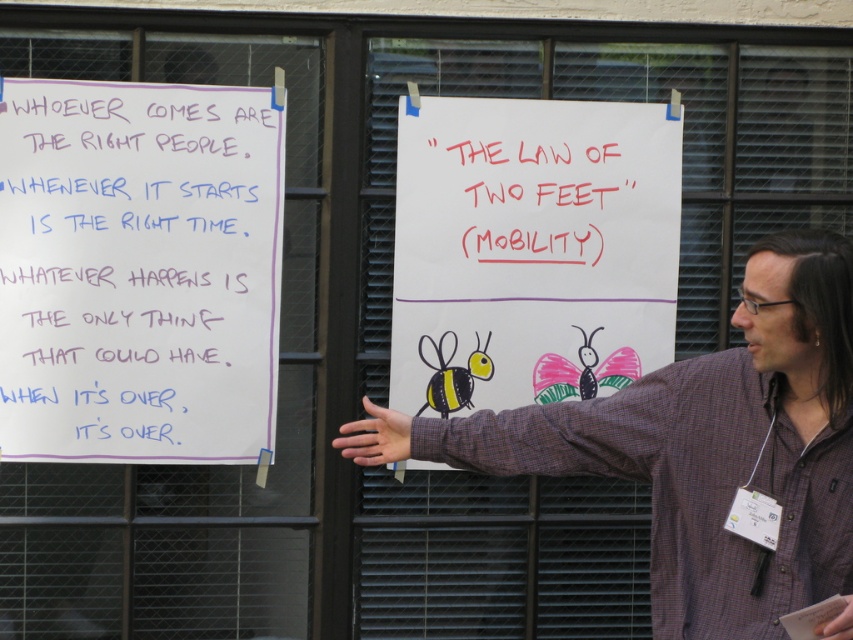
Question: Which of the following is the closest to the observer?

Choices:
 (A) (554, 368)
 (B) (816, 355)
 (C) (474, 376)
 (D) (419, 200)

Answer: (B)

Question: Among these objects, which one is nearest to the camera?

Choices:
 (A) plaid shirt at center
 (B) yellow matte bee at center
 (C) white paper at left

Answer: (A)

Question: Is plaid shirt at center to the right of pink matte butterfly at center from the viewer's perspective?

Choices:
 (A) no
 (B) yes

Answer: (B)

Question: Does red marker text at upper center appear under yellow matte bee at center?

Choices:
 (A) no
 (B) yes

Answer: (A)

Question: Which object appears farthest from the camera in this image?

Choices:
 (A) plaid shirt at center
 (B) matte white paper at center
 (C) yellow matte bee at center
 (D) pink matte butterfly at center

Answer: (D)

Question: Is white paper at left thinner than matte white paper at center?

Choices:
 (A) no
 (B) yes

Answer: (B)